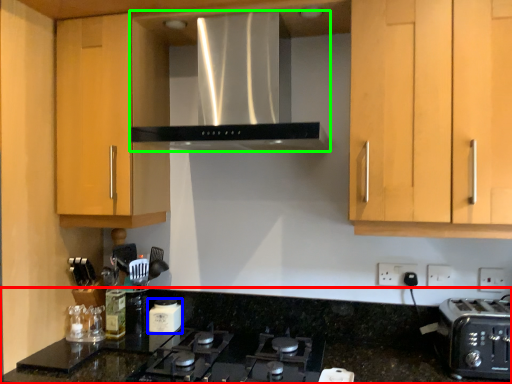
Question: Which is nearer to the countertop (highlighted by a red box)? kitchen appliance (highlighted by a blue box) or home appliance (highlighted by a green box).

Choices:
 (A) kitchen appliance
 (B) home appliance

Answer: (A)